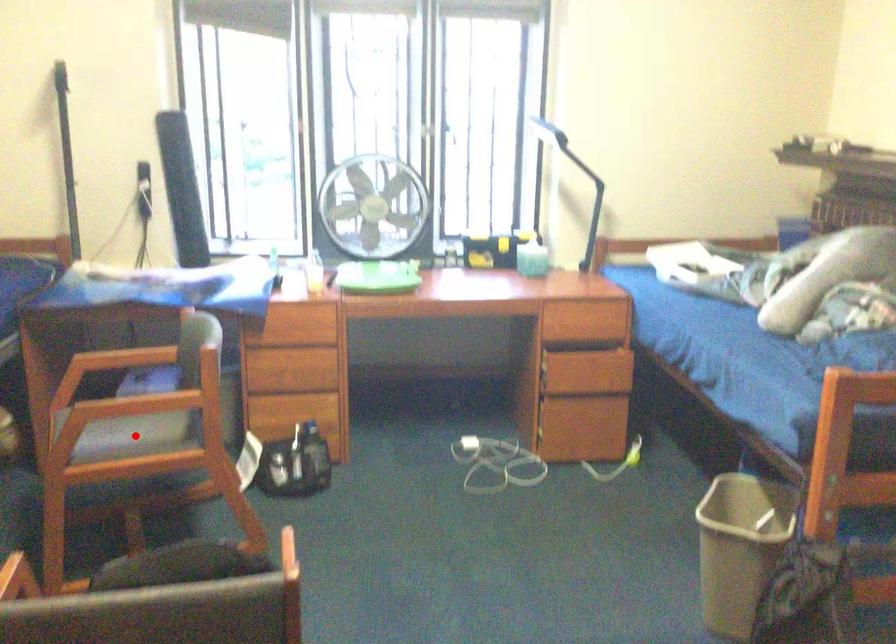
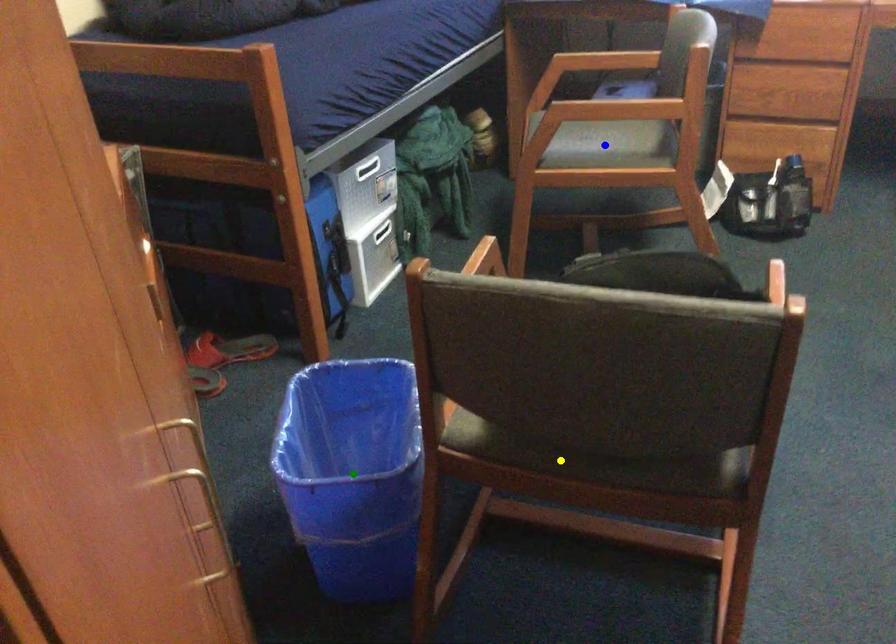
Question: I am providing you with two images of the same scene from different viewpoints. A red point is marked on the first image. You are given multiple points on the second image. Which point in image 2 represents the same 3d spot as the red point in image 1?

Choices:
 (A) green point
 (B) blue point
 (C) yellow point

Answer: (B)